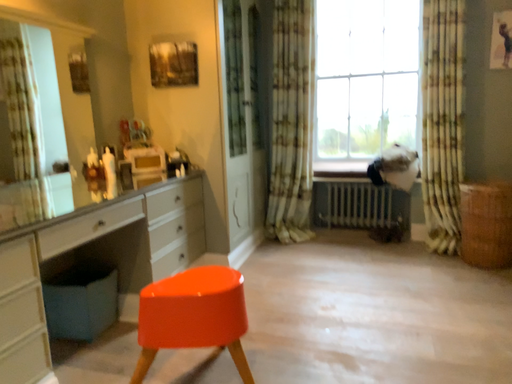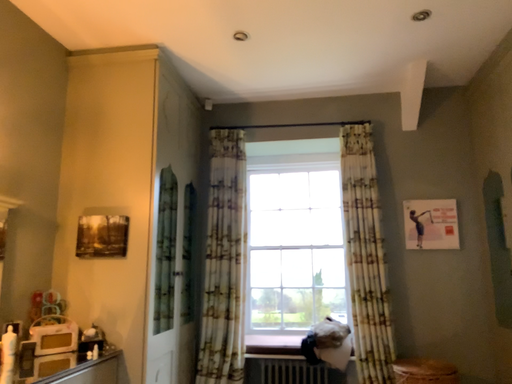
Question: Which way did the camera rotate in the video?

Choices:
 (A) rotated upward
 (B) rotated downward

Answer: (A)